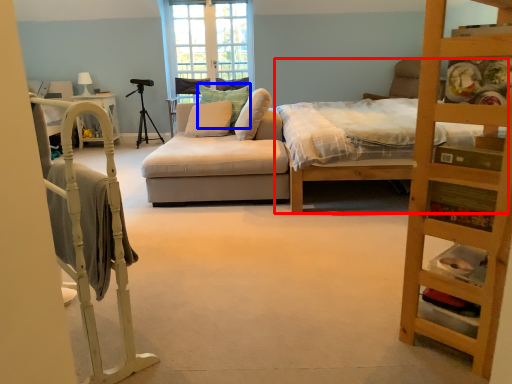
Question: Among these objects, which one is nearest to the camera, bed (highlighted by a red box) or pillow (highlighted by a blue box)?

Choices:
 (A) bed
 (B) pillow

Answer: (A)